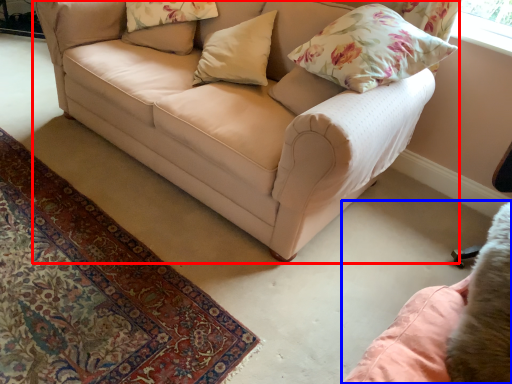
Question: Which object is further to the camera taking this photo, studio couch (highlighted by a red box) or swivel chair (highlighted by a blue box)?

Choices:
 (A) studio couch
 (B) swivel chair

Answer: (A)